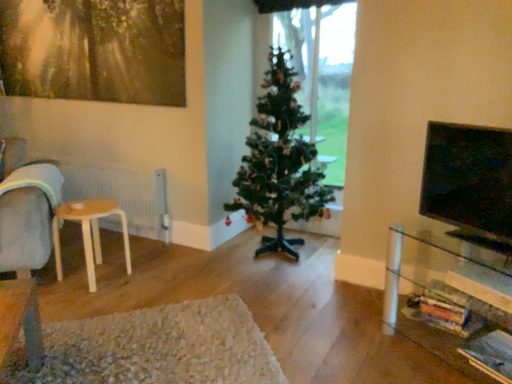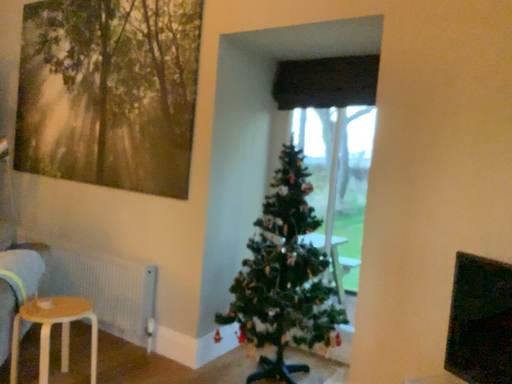
Question: How did the camera likely rotate when shooting the video?

Choices:
 (A) rotated upward
 (B) rotated downward

Answer: (A)